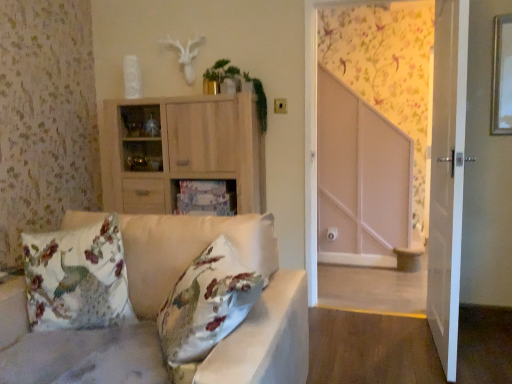
The image size is (512, 384). Describe the element at coordinates (183, 151) in the screenshot. I see `light wood cabinet at center, placed as the 2th cabinetry when sorted from bottom to top` at that location.

I want to click on satin white studio couch at left, so click(x=249, y=312).

The image size is (512, 384). In order to click on floral wallpaper at upper right in this screenshot , I will do `click(388, 71)`.

What are the coordinates of `wooden cabinet at center, positioned as the 2th cabinetry in top-to-bottom order` in the screenshot? It's located at (205, 198).

From a real-world perspective, which object rests below the other?

satin white studio couch at left is physically lower.

Is satin white studio couch at left far from light wood cabinet at center, placed as the 2th cabinetry when sorted from bottom to top?

Yes.

Based on the photo, between satin white studio couch at left and light wood cabinet at center, placed as the 2th cabinetry when sorted from bottom to top, which one has less height?

light wood cabinet at center, placed as the 2th cabinetry when sorted from bottom to top, is shorter.

Based on their positions, is satin white studio couch at left located to the left or right of light wood cabinet at center, the first cabinetry from the top?

satin white studio couch at left is to the left of light wood cabinet at center, the first cabinetry from the top.

Consider the image. Is wooden cabinet at center, the first cabinetry positioned from the bottom, at the back of light wood cabinet at center, placed as the 2th cabinetry when sorted from bottom to top?

Yes, wooden cabinet at center, the first cabinetry positioned from the bottom, is at the back of light wood cabinet at center, placed as the 2th cabinetry when sorted from bottom to top.

Is light wood cabinet at center, placed as the 2th cabinetry when sorted from bottom to top, in front of or behind wooden cabinet at center, the first cabinetry positioned from the bottom, in the image?

In the image, light wood cabinet at center, placed as the 2th cabinetry when sorted from bottom to top, appears in front of wooden cabinet at center, the first cabinetry positioned from the bottom.

From a real-world perspective, which is physically below, light wood cabinet at center, placed as the 2th cabinetry when sorted from bottom to top, or wooden cabinet at center, positioned as the 2th cabinetry in top-to-bottom order?

From a 3D spatial view, wooden cabinet at center, positioned as the 2th cabinetry in top-to-bottom order, is below.

From the image's perspective, is white glossy door at right positioned above or below floral fabric cushion at left?

white glossy door at right is situated higher than floral fabric cushion at left in the image.

Is point (456, 142) in front of point (50, 287)?

No, (456, 142) is behind (50, 287).

Are white glossy door at right and floral fabric cushion at left located far from each other?

white glossy door at right is far away from floral fabric cushion at left.

Who is bigger, white glossy door at right or floral fabric cushion at left?

white glossy door at right.

Looking at this image, between floral fabric cushion at left and satin white studio couch at left, which one has smaller width?

floral fabric cushion at left is thinner.

Does floral fabric cushion at left have a lesser height compared to satin white studio couch at left?

Indeed, floral fabric cushion at left has a lesser height compared to satin white studio couch at left.

What are the coordinates of `studio couch that appears on the right of floral fabric cushion at left` in the screenshot? It's located at (249, 312).

Considering the points (113, 214) and (209, 372), which point is in front, point (113, 214) or point (209, 372)?

The point (209, 372) is closer to the camera.

From the picture: Is light wood cabinet at center, the first cabinetry from the top, looking in the opposite direction of floral fabric cushion at left?

No, light wood cabinet at center, the first cabinetry from the top, is not facing the opposite direction of floral fabric cushion at left.

Considering the points (207, 133) and (75, 233), which point is in front, point (207, 133) or point (75, 233)?

The point (75, 233) is in front.

What's the angular difference between light wood cabinet at center, placed as the 2th cabinetry when sorted from bottom to top, and floral fabric cushion at left's facing directions?

light wood cabinet at center, placed as the 2th cabinetry when sorted from bottom to top, and floral fabric cushion at left are facing 9.43 degrees away from each other.

Is light wood cabinet at center, the first cabinetry from the top, positioned behind floral fabric cushion at left?

Yes, it is.

Considering the positions of objects white glossy door at right and floral wallpaper at upper right in the image provided, who is in front, white glossy door at right or floral wallpaper at upper right?

white glossy door at right is in front.

The image size is (512, 384). I want to click on curtain above the white glossy door at right (from the image's perspective), so click(388, 71).

Based on their sizes in the image, would you say white glossy door at right is bigger or smaller than floral wallpaper at upper right?

white glossy door at right is bigger than floral wallpaper at upper right.

Is floral fabric cushion at left in front of or behind light wood cabinet at center, the first cabinetry from the top, in the image?

In the image, floral fabric cushion at left appears in front of light wood cabinet at center, the first cabinetry from the top.

Between floral fabric cushion at left and light wood cabinet at center, the first cabinetry from the top, which one has smaller width?

With smaller width is floral fabric cushion at left.

Considering the positions of point (56, 284) and point (115, 185), is point (56, 284) closer or farther from the camera than point (115, 185)?

Clearly, point (56, 284) is closer to the camera than point (115, 185).

Based on the photo, from a real-world perspective, which is physically above, floral fabric cushion at left or light wood cabinet at center, the first cabinetry from the top?

light wood cabinet at center, the first cabinetry from the top, is physically above.

Locate an element on the screen. This screenshot has height=384, width=512. the 2nd cabinetry directly above the satin white studio couch at left (from a real-world perspective) is located at coordinates (183, 151).

This screenshot has width=512, height=384. I want to click on cabinetry below the light wood cabinet at center, placed as the 2th cabinetry when sorted from bottom to top (from a real-world perspective), so click(x=205, y=198).

Looking at the image, which one is located closer to light wood cabinet at center, placed as the 2th cabinetry when sorted from bottom to top, white glossy door at right or floral fabric cushion at left?

The object closer to light wood cabinet at center, placed as the 2th cabinetry when sorted from bottom to top, is floral fabric cushion at left.

Looking at the image, which one is located further to floral wallpaper at upper right, wooden cabinet at center, positioned as the 2th cabinetry in top-to-bottom order, or satin white studio couch at left?

satin white studio couch at left lies further to floral wallpaper at upper right than the other object.

Which object lies nearer to the anchor point white glossy door at right, satin white studio couch at left or floral fabric cushion at left?

satin white studio couch at left is positioned closer to the anchor white glossy door at right.

Considering their positions, is floral wallpaper at upper right positioned closer to white glossy door at right than wooden cabinet at center, positioned as the 2th cabinetry in top-to-bottom order?

wooden cabinet at center, positioned as the 2th cabinetry in top-to-bottom order, is closer to white glossy door at right.

Based on their spatial positions, is floral fabric cushion at left or satin white studio couch at left closer to wooden cabinet at center, positioned as the 2th cabinetry in top-to-bottom order?

floral fabric cushion at left lies closer to wooden cabinet at center, positioned as the 2th cabinetry in top-to-bottom order, than the other object.

From the image, which object appears to be farther from light wood cabinet at center, the first cabinetry from the top, satin white studio couch at left or white glossy door at right?

The object further to light wood cabinet at center, the first cabinetry from the top, is white glossy door at right.

Considering their positions, is floral wallpaper at upper right positioned further to floral fabric cushion at left than wooden cabinet at center, the first cabinetry positioned from the bottom?

floral wallpaper at upper right lies further to floral fabric cushion at left than the other object.

From the image, which object appears to be farther from light wood cabinet at center, placed as the 2th cabinetry when sorted from bottom to top, wooden cabinet at center, positioned as the 2th cabinetry in top-to-bottom order, or white glossy door at right?

white glossy door at right.

In order to click on curtain situated between wooden cabinet at center, positioned as the 2th cabinetry in top-to-bottom order, and white glossy door at right from left to right in this screenshot , I will do pyautogui.click(x=388, y=71).

Identify the location of studio couch between floral fabric cushion at left and white glossy door at right in the horizontal direction. This screenshot has width=512, height=384. (249, 312).

Image resolution: width=512 pixels, height=384 pixels. I want to click on cabinetry between light wood cabinet at center, the first cabinetry from the top, and white glossy door at right, so click(205, 198).

Locate an element on the screen. pillow between satin white studio couch at left and wooden cabinet at center, the first cabinetry positioned from the bottom, along the z-axis is located at coordinates (77, 278).